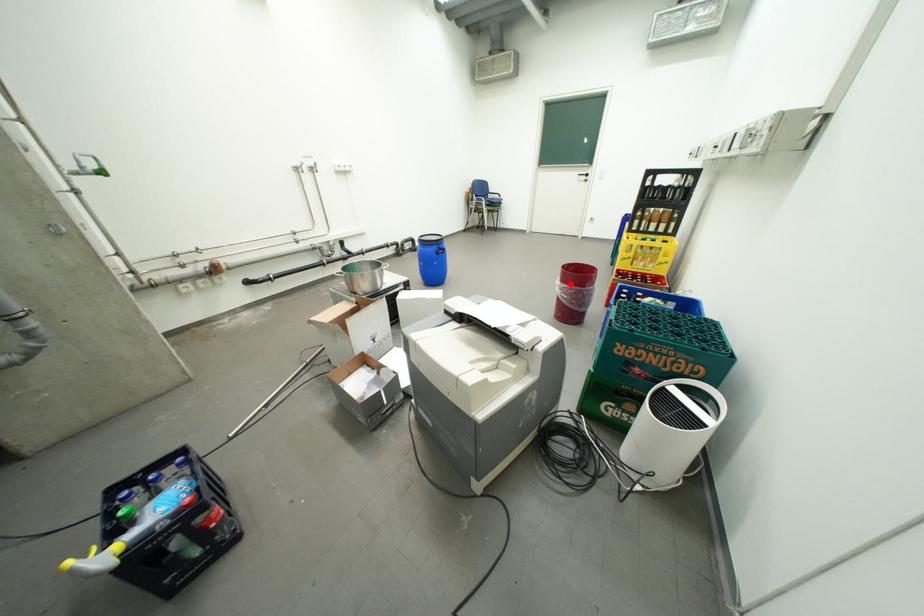
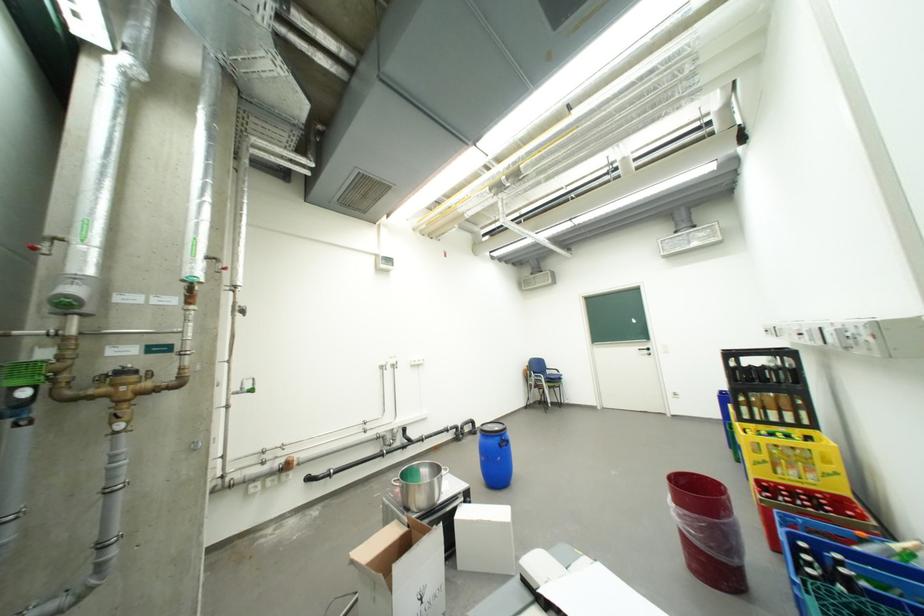
In the second image, find the point that corresponds to the highlighted location in the first image.

(685, 507)